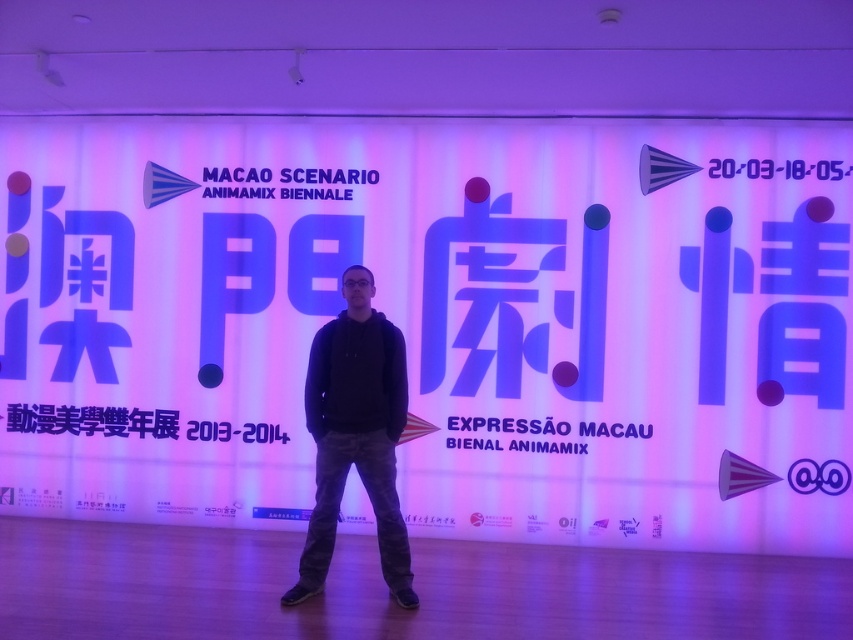
You are a photographer setting up for an event. You need to ensure that the black cotton hoodie at center is visible in the photo. Given that the white matte sign at center is already in the frame, should you adjust your camera position to move closer to or further away from the backdrop?

The black cotton hoodie at center is behind the white matte sign at center. To make the hoodie visible, you should move closer to the backdrop so that the white matte sign at center is moved out of the way, allowing the hoodie to be seen.

You are a photographer adjusting your camera settings to capture the backdrop clearly. You notice two points marked on the backdrop at coordinates point (756, 196) and point (415, 605). Which point is closer to your camera lens?

Point (415, 605) is closer to the camera lens because it is less further than point (756, 196) which is further to the viewer.